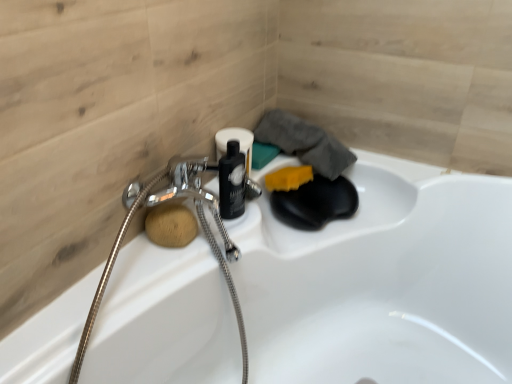
Question: Does wooden sponge at lower left, marked as the first soap in a left-to-right arrangement, have a greater height compared to yellow sponge at upper right, the first soap in the right-to-left sequence?

Choices:
 (A) no
 (B) yes

Answer: (B)

Question: From a real-world perspective, is wooden sponge at lower left, marked as the first soap in a left-to-right arrangement, positioned under yellow sponge at upper right, positioned as the second soap in left-to-right order, based on gravity?

Choices:
 (A) yes
 (B) no

Answer: (B)

Question: Can you confirm if wooden sponge at lower left, the first soap viewed from the front, is shorter than yellow sponge at upper right, positioned as the second soap in left-to-right order?

Choices:
 (A) no
 (B) yes

Answer: (A)

Question: Is wooden sponge at lower left, which ranks as the second soap in top-to-bottom order, not near yellow sponge at upper right, the second soap in the bottom-to-top sequence?

Choices:
 (A) yes
 (B) no

Answer: (B)

Question: Is wooden sponge at lower left, marked as the first soap in a left-to-right arrangement, wider than yellow sponge at upper right, placed as the first soap when sorted from top to bottom?

Choices:
 (A) no
 (B) yes

Answer: (A)

Question: Does wooden sponge at lower left, the first soap viewed from the front, appear on the left side of yellow sponge at upper right, the first soap in the right-to-left sequence?

Choices:
 (A) yes
 (B) no

Answer: (A)

Question: Does yellow sponge at upper right, positioned as the second soap in front-to-back order, appear on the left side of wooden sponge at lower left, which ranks as the 2th soap in back-to-front order?

Choices:
 (A) no
 (B) yes

Answer: (A)

Question: Is wooden sponge at lower left, which ranks as the 2th soap in back-to-front order, surrounded by yellow sponge at upper right, acting as the first soap starting from the back?

Choices:
 (A) no
 (B) yes

Answer: (A)

Question: Are yellow sponge at upper right, acting as the first soap starting from the back, and wooden sponge at lower left, which is the 1th soap in bottom-to-top order, beside each other?

Choices:
 (A) no
 (B) yes

Answer: (A)

Question: Is yellow sponge at upper right, acting as the first soap starting from the back, far from wooden sponge at lower left, the first soap viewed from the front?

Choices:
 (A) no
 (B) yes

Answer: (A)

Question: From the image's perspective, is yellow sponge at upper right, the second soap in the bottom-to-top sequence, beneath wooden sponge at lower left, which ranks as the 2th soap in back-to-front order?

Choices:
 (A) yes
 (B) no

Answer: (B)

Question: Is yellow sponge at upper right, positioned as the second soap in left-to-right order, to the right of wooden sponge at lower left, which is the 1th soap in bottom-to-top order, from the viewer's perspective?

Choices:
 (A) no
 (B) yes

Answer: (B)

Question: Does wooden sponge at lower left, which ranks as the 2th soap in back-to-front order, have a smaller size compared to metallic silver garden hose at left?

Choices:
 (A) yes
 (B) no

Answer: (A)